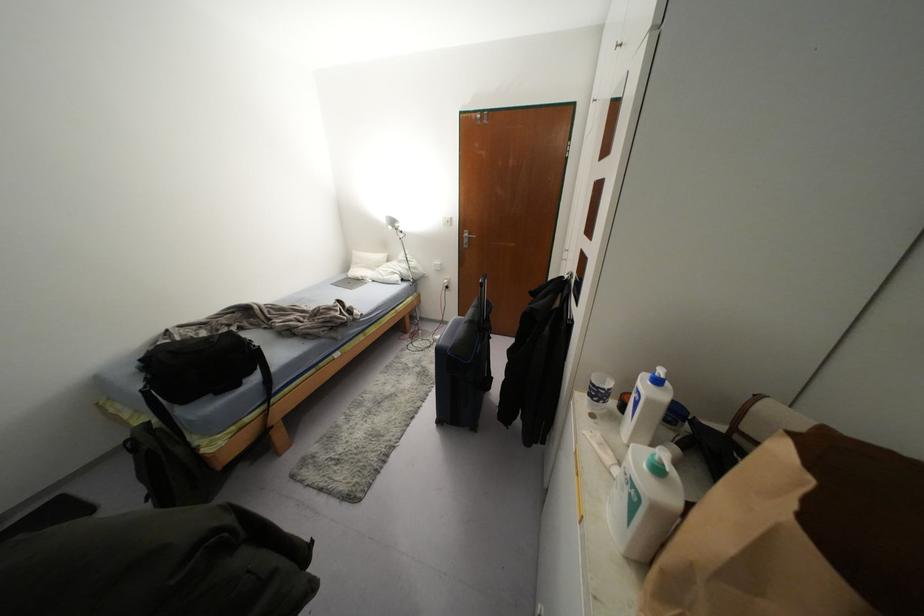
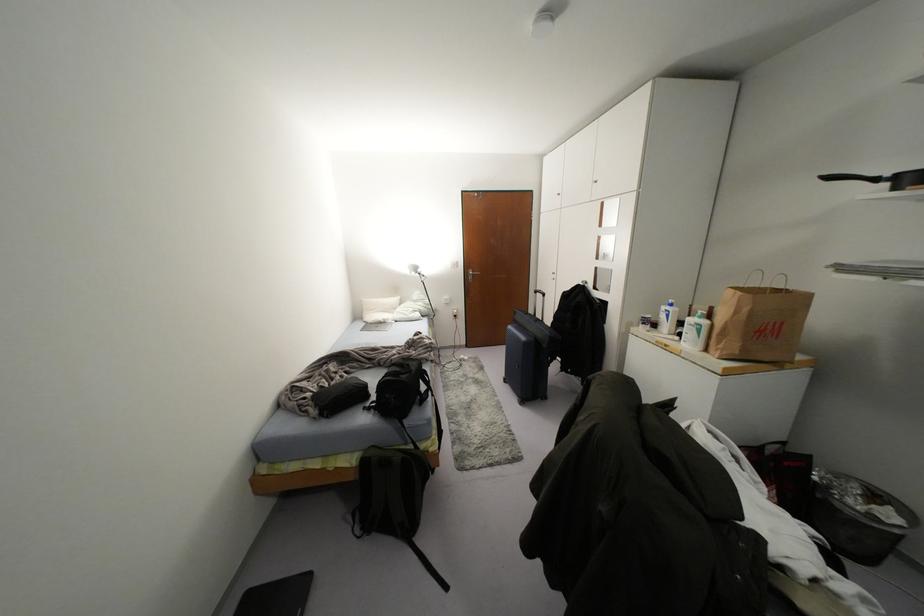
Where in the second image is the point corresponding to the point at 395,225 from the first image?

(419, 270)